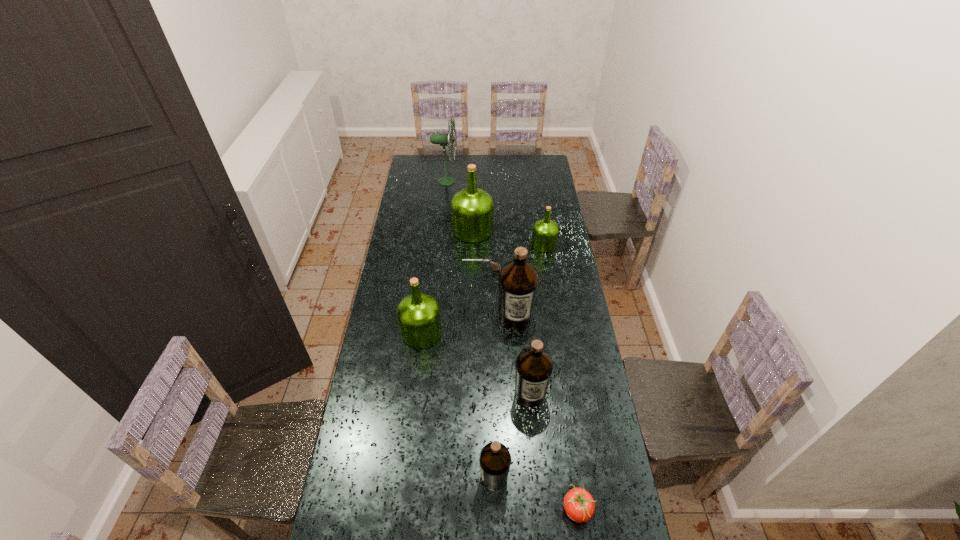
At what (x,y) coordinates should I click in order to perform the action: click on the nearest brown olive oil. Please return your answer as a coordinate pair (x, y). The width and height of the screenshot is (960, 540). Looking at the image, I should click on (495, 459).

At what (x,y) coordinates should I click in order to perform the action: click on the smallest brown olive oil. Please return your answer as a coordinate pair (x, y). This screenshot has height=540, width=960. Looking at the image, I should click on (495, 459).

You are a GUI agent. You are given a task and a screenshot of the screen. Output one action in this format:
    pyautogui.click(x=<x>, y=<y>)
    Task: Click on the tomato
    The width and height of the screenshot is (960, 540).
    Given the screenshot: What is the action you would take?
    pyautogui.click(x=579, y=505)

Identify the location of red tomato. The width and height of the screenshot is (960, 540). (579, 505).

Locate an element on the screen. gun is located at coordinates (485, 261).

Where is `the sixth nearest object`? the sixth nearest object is located at coordinates (485, 261).

You are a GUI agent. You are given a task and a screenshot of the screen. Output one action in this format:
    pyautogui.click(x=<x>, y=<y>)
    Task: Click on the vacant area located on the front-facing side of the green fan
    Image resolution: width=960 pixels, height=540 pixels.
    Given the screenshot: What is the action you would take?
    pyautogui.click(x=478, y=181)

At what (x,y) coordinates should I click in order to perform the action: click on free location located 0.310m on the label of the biggest brown olive oil. Please return your answer as a coordinate pair (x, y). The width and height of the screenshot is (960, 540). Looking at the image, I should click on (521, 400).

This screenshot has height=540, width=960. I want to click on vacant region located on the right of the second green olive oil from left to right, so click(x=553, y=230).

Where is `free spot located on the front of the second biggest green olive oil`? free spot located on the front of the second biggest green olive oil is located at coordinates (418, 366).